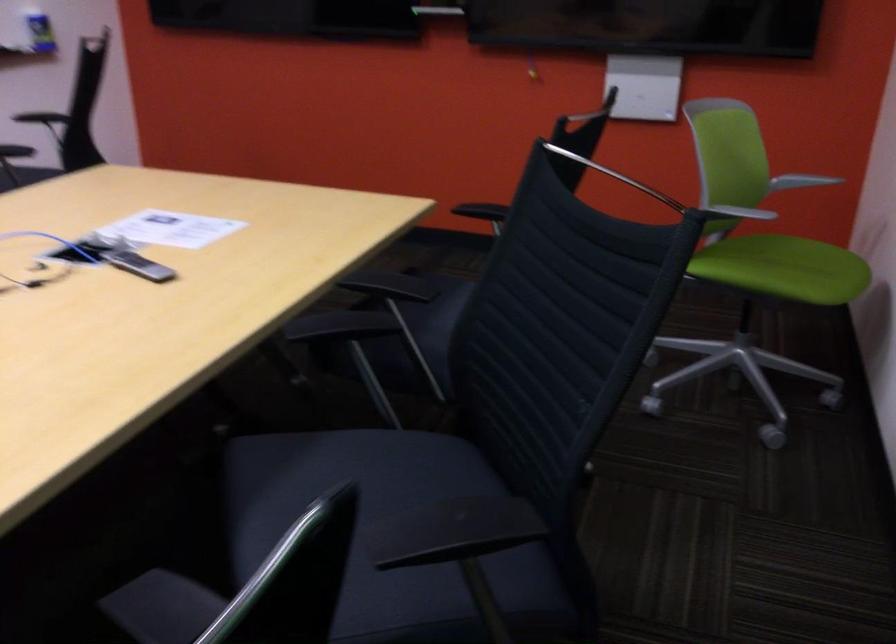
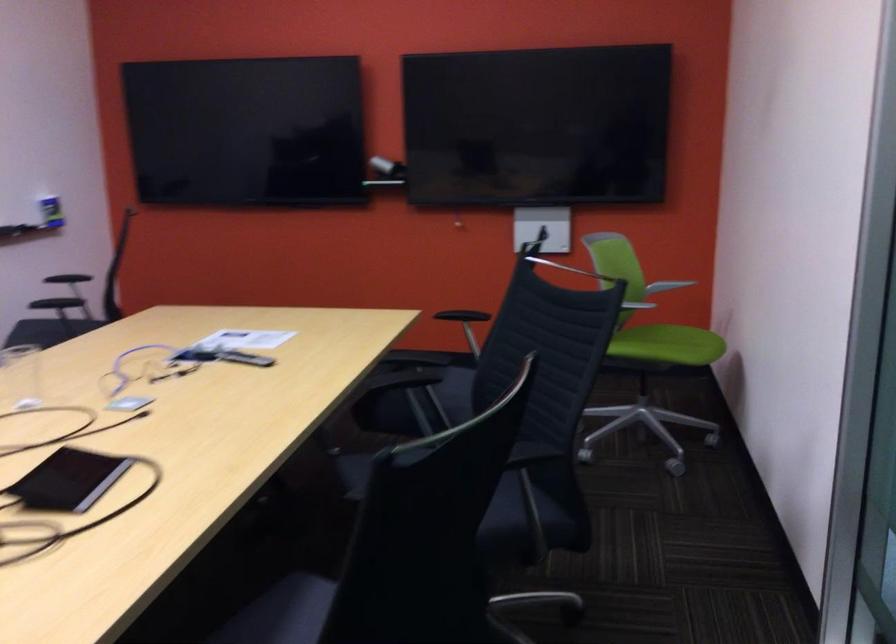
Locate, in the second image, the point that corresponds to point 138,267 in the first image.

(244, 357)